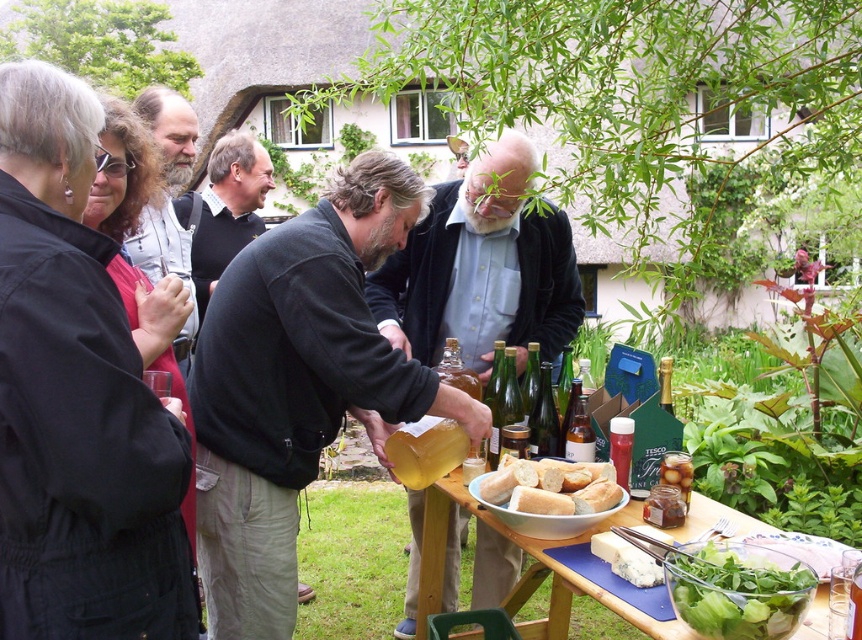
Question: Is dark gray sweater at center above wooden table at lower center?

Choices:
 (A) yes
 (B) no

Answer: (A)

Question: Which is farther from the smooth brown leather jacket at center?

Choices:
 (A) black leather jacket at center
 (B) dark gray sweater at center

Answer: (A)

Question: Among these points, which one is farthest from the camera?

Choices:
 (A) (604, 509)
 (B) (457, 172)
 (C) (257, 173)
 (D) (457, 586)

Answer: (B)

Question: Which of the following is the closest to the observer?

Choices:
 (A) (464, 172)
 (B) (745, 632)
 (C) (519, 538)
 (D) (254, 198)

Answer: (B)

Question: Can you confirm if dark gray sweater at center is positioned above black leather jacket at center?

Choices:
 (A) yes
 (B) no

Answer: (B)

Question: Considering the relative positions of dark gray sweater at center and smooth brown leather jacket at center in the image provided, where is dark gray sweater at center located with respect to smooth brown leather jacket at center?

Choices:
 (A) right
 (B) left

Answer: (B)